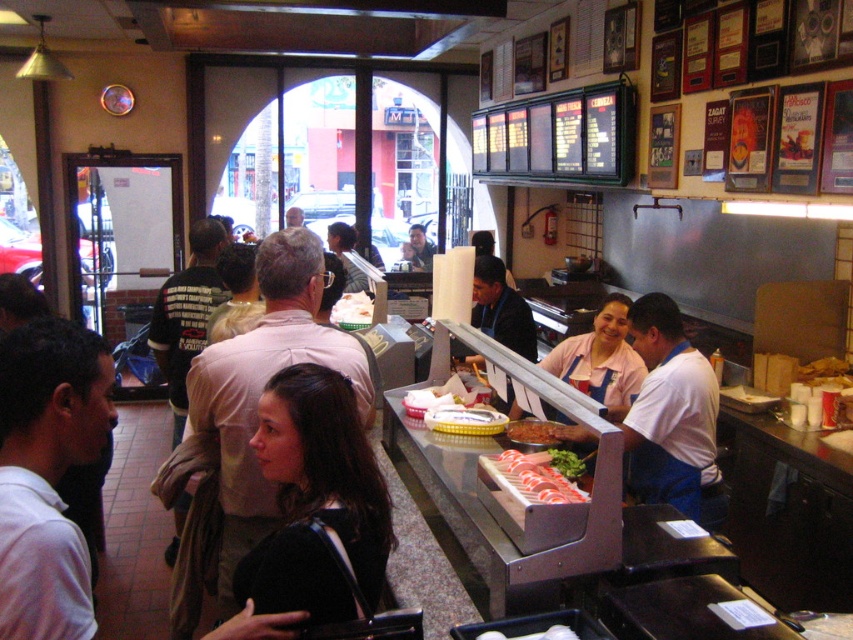
You are a customer at the restaurant and want to pack the slightly browned bread at counter into the white paper bag at center. Will the bread fit inside the bag?

The white paper bag at center is wider than the slightly browned bread at counter, so the bread will fit inside the bag.

You are a customer at the restaurant counter. You see the black fabric shirt at center and the slightly browned bread at counter. Which item is closer to you?

The black fabric shirt at center is closer to you because it is positioned under the slightly browned bread at counter, meaning it is in a lower plane and thus nearer to your viewpoint.

You are a customer at the restaurant and want to take both the white paper bag at center and the slightly browned bread at counter with you. Which one can you fit into your small handbag that can only hold items smaller than the other?

The slightly browned bread at counter is smaller than the white paper bag at center, so it can fit into your small handbag.